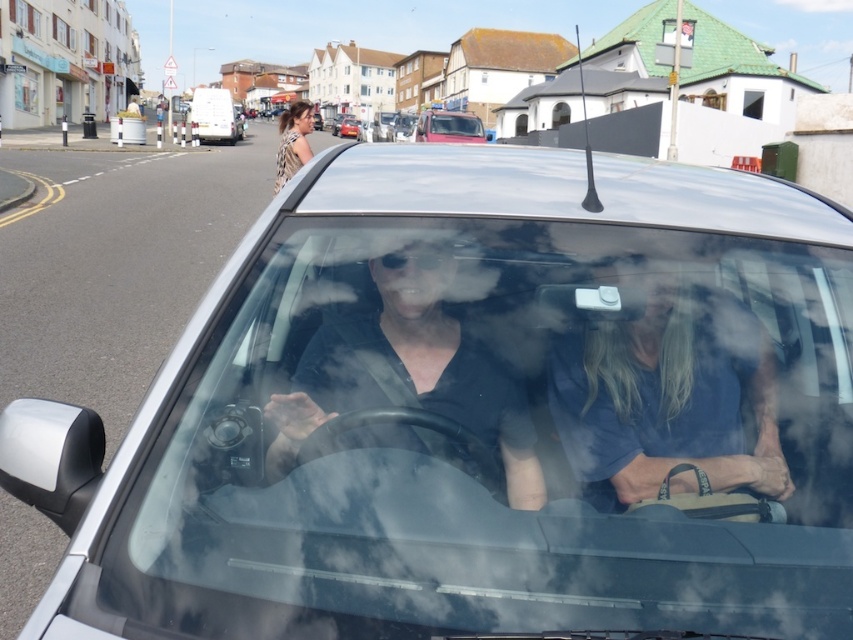
Question: Is camouflage fabric top at upper center below transparent glass windshield at center?

Choices:
 (A) yes
 (B) no

Answer: (A)

Question: Which point is closer to the camera?

Choices:
 (A) (276, 173)
 (B) (573, 449)
 (C) (433, 404)
 (D) (460, 125)

Answer: (B)

Question: Can you confirm if matte black shirt at center is smaller than camouflage fabric top at upper center?

Choices:
 (A) no
 (B) yes

Answer: (B)

Question: Which is farther from the blue fabric bag at center?

Choices:
 (A) matte black shirt at center
 (B) transparent glass windshield at center

Answer: (B)

Question: Is matte black shirt at center thinner than transparent glass windshield at center?

Choices:
 (A) no
 (B) yes

Answer: (B)

Question: Which of the following is the closest to the observer?

Choices:
 (A) (459, 116)
 (B) (646, 404)

Answer: (B)